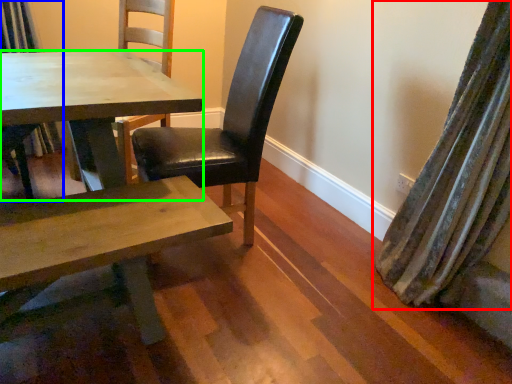
Question: Estimate the real-world distances between objects in this image. Which object is closer to curtain (highlighted by a red box), chair (highlighted by a blue box) or kitchen & dining room table (highlighted by a green box)?

Choices:
 (A) chair
 (B) kitchen & dining room table

Answer: (B)